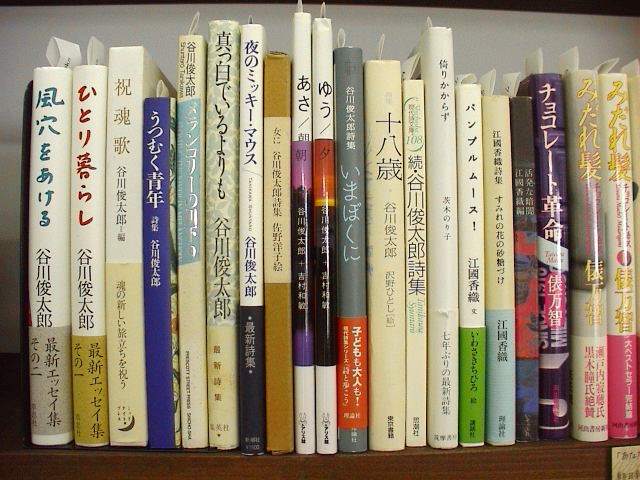
Find the location of a particular element. The width and height of the screenshot is (640, 480). wall is located at coordinates (496, 30).